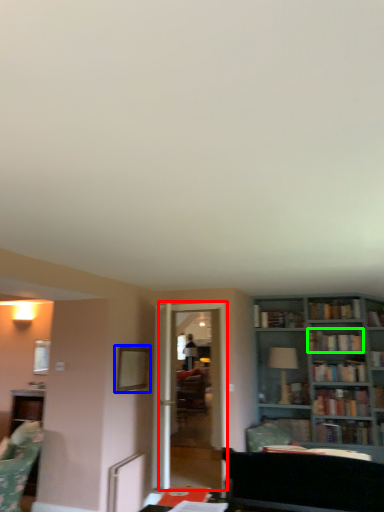
Question: Which object is positioned farthest from glass door (highlighted by a red box)? Select from picture frame (highlighted by a blue box) and book (highlighted by a green box).

Choices:
 (A) picture frame
 (B) book

Answer: (B)